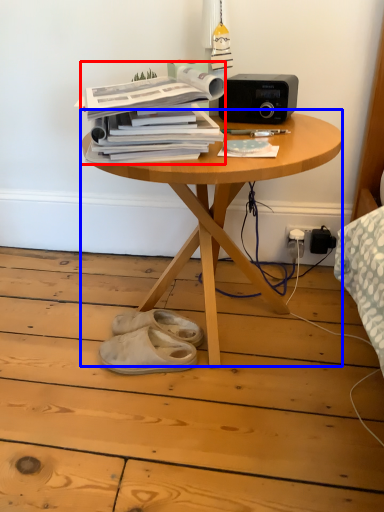
Question: Which object appears farthest to the camera in this image, paperback book (highlighted by a red box) or table (highlighted by a blue box)?

Choices:
 (A) paperback book
 (B) table

Answer: (A)